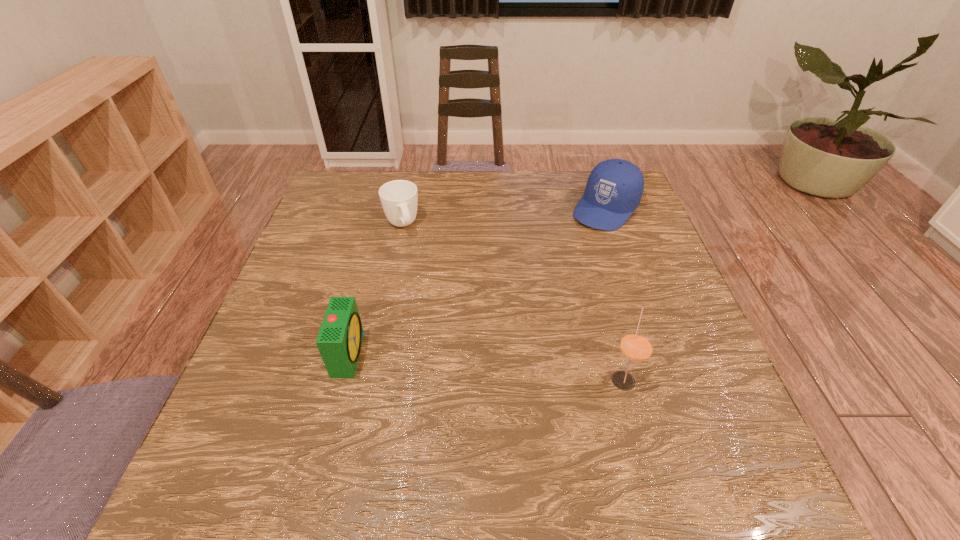
Image resolution: width=960 pixels, height=540 pixels. What are the coordinates of `vacant space situated with the handle on the side of the cup` in the screenshot? It's located at (411, 254).

Where is `vacant region located with the handle on the side of the cup`? Image resolution: width=960 pixels, height=540 pixels. vacant region located with the handle on the side of the cup is located at coordinates (416, 266).

This screenshot has width=960, height=540. I want to click on cap at the far edge, so click(x=614, y=188).

Identify the location of cup that is positioned at the far edge. This screenshot has height=540, width=960. 399,198.

At what (x,y) coordinates should I click in order to perform the action: click on object positioned at the right edge. Please return your answer as a coordinate pair (x, y). Image resolution: width=960 pixels, height=540 pixels. Looking at the image, I should click on (614, 188).

Locate an element on the screen. object located in the far right corner section of the desktop is located at coordinates (614, 188).

Locate an element on the screen. The width and height of the screenshot is (960, 540). free space at the far edge is located at coordinates (567, 185).

At what (x,y) coordinates should I click in order to perform the action: click on vacant position at the near edge of the desktop. Please return your answer as a coordinate pair (x, y). The height and width of the screenshot is (540, 960). Looking at the image, I should click on (543, 406).

In the image, there is a desktop. At what (x,y) coordinates should I click in order to perform the action: click on vacant space at the left edge. Please return your answer as a coordinate pair (x, y). Looking at the image, I should click on (280, 307).

In the image, there is a desktop. Identify the location of vacant space at the right edge. The height and width of the screenshot is (540, 960). (693, 336).